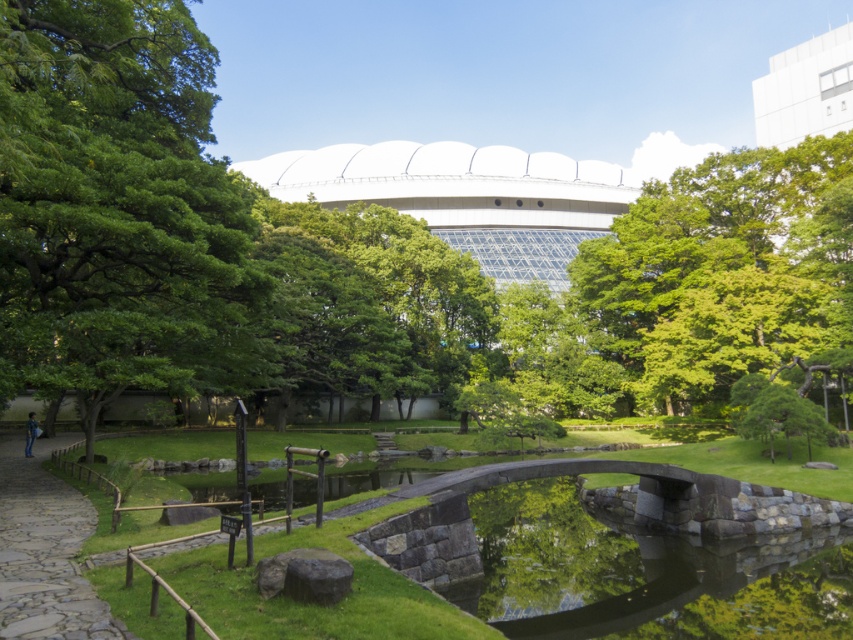
Question: Is the position of green leafy tree at upper left more distant than that of green leafy tree at upper center?

Choices:
 (A) yes
 (B) no

Answer: (B)

Question: Considering the real-world distances, which object is farthest from the green leafy tree at upper center?

Choices:
 (A) green leafy tree at upper left
 (B) pebble stone path at lower left

Answer: (B)

Question: Does green leafy tree at upper center have a lesser width compared to pebble stone path at lower left?

Choices:
 (A) no
 (B) yes

Answer: (A)

Question: Which point is farther from the camera taking this photo?

Choices:
 (A) (10, 444)
 (B) (186, 24)

Answer: (A)

Question: Is green leafy tree at upper left wider than green leafy tree at upper center?

Choices:
 (A) no
 (B) yes

Answer: (A)

Question: Which object is farther from the camera taking this photo?

Choices:
 (A) green leafy tree at upper center
 (B) green leafy tree at upper left
 (C) pebble stone path at lower left

Answer: (A)